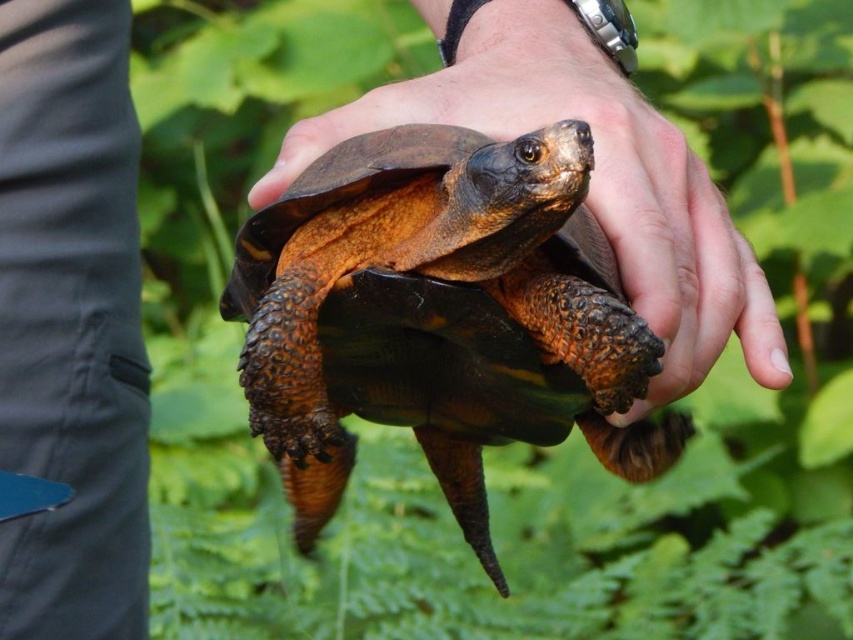
In the scene, you see a brown rough textured tortoise at center and a brown rough skin at center. Which object is positioned to the left?

The brown rough textured tortoise at center is to the left of the brown rough skin at center.

You are a nature photographer observing the scene. You notice the brown rough textured tortoise at center and the brown rough skin at center. Which object is positioned lower in the image?

The brown rough textured tortoise at center is located below brown rough skin at center, so the brown rough textured tortoise at center is positioned lower in the image.

You are a wildlife researcher observing the brown rough textured tortoise at center and the brown rough skin at center. Which object is taller?

The brown rough textured tortoise at center is taller than the brown rough skin at center.